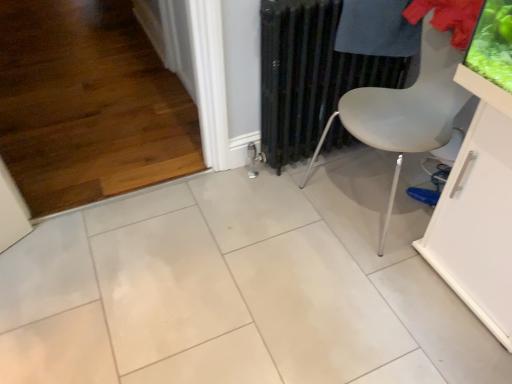
Image resolution: width=512 pixels, height=384 pixels. Find the location of `vacant space behind blue fabric shoe at lower right`. vacant space behind blue fabric shoe at lower right is located at coordinates (414, 178).